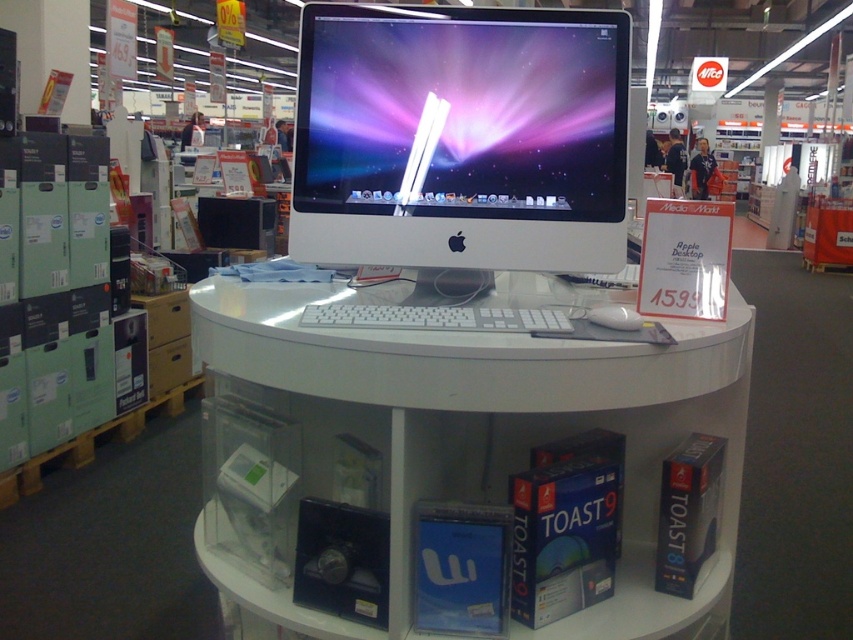
You are setting up a new computer desk in your home office and want to place your monitor on it. Based on the image, will the white glossy computer desk at center have enough space to accommodate the white glossy computer monitor at center?

The white glossy computer desk at center has a larger width than the white glossy computer monitor at center, so yes, it will have enough space to accommodate the monitor.

You are a delivery person who needs to place a new keyboard on the lower shelf with the boxed software products. The new keyboard is 0.5 meters wide. Can the white matte keyboard at center currently on the lower shelf be moved to make space?

The white matte keyboard at center is located 1.12 meters away from the camera, so it can be moved to the lower shelf to make space for the new keyboard since the distance allows accessibility.